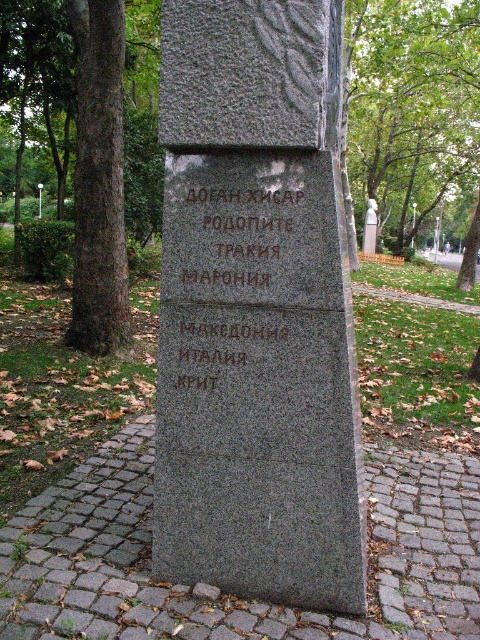
Question: Is granite stone monument at center thinner than sanded stone statue at center?

Choices:
 (A) yes
 (B) no

Answer: (B)

Question: Which point is farther to the camera?

Choices:
 (A) (439, 196)
 (B) (287, 61)

Answer: (A)

Question: Can you confirm if green leafy tree at upper center is smaller than black granite stone at center?

Choices:
 (A) no
 (B) yes

Answer: (B)

Question: Is the position of green leafy tree at upper center less distant than that of black granite stone at center?

Choices:
 (A) no
 (B) yes

Answer: (A)

Question: Based on their relative distances, which object is nearer to the brown textured tree trunk at left?

Choices:
 (A) green leafy tree at upper center
 (B) black granite stone at center
 (C) granite stone monument at center
 (D) sanded stone statue at center

Answer: (B)

Question: Which of the following is the closest to the observer?

Choices:
 (A) granite stone monument at center
 (B) green leafy tree at upper center
 (C) brown textured tree trunk at left
 (D) sanded stone statue at center

Answer: (A)